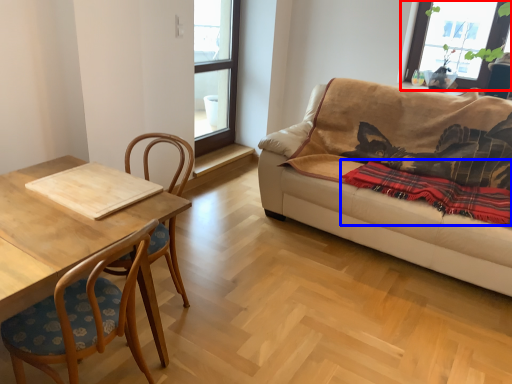
Question: Which point is closer to the camera, window (highlighted by a red box) or blanket (highlighted by a blue box)?

Choices:
 (A) window
 (B) blanket

Answer: (B)